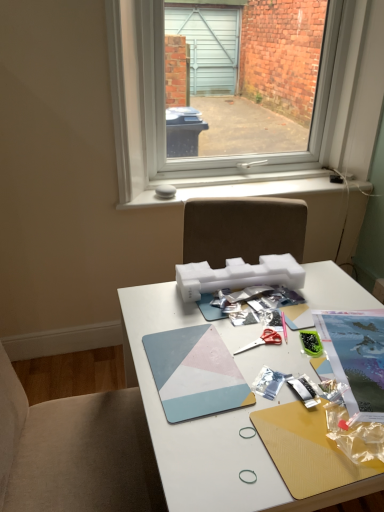
Question: From a real-world perspective, is red plastic scissors at center positioned over geometric matte mousepad at center, positioned as the first magazine in left-to-right order, based on gravity?

Choices:
 (A) no
 (B) yes

Answer: (A)

Question: Is red plastic scissors at center directly adjacent to geometric matte mousepad at center, positioned as the first magazine in left-to-right order?

Choices:
 (A) no
 (B) yes

Answer: (A)

Question: Is red plastic scissors at center looking in the opposite direction of geometric matte mousepad at center, positioned as the first magazine in left-to-right order?

Choices:
 (A) no
 (B) yes

Answer: (A)

Question: Is red plastic scissors at center not near geometric matte mousepad at center, acting as the 2th magazine starting from the right?

Choices:
 (A) no
 (B) yes

Answer: (A)

Question: Does red plastic scissors at center have a lesser width compared to geometric matte mousepad at center, acting as the 2th magazine starting from the right?

Choices:
 (A) no
 (B) yes

Answer: (B)

Question: Can you confirm if red plastic scissors at center is bigger than geometric matte mousepad at center, positioned as the first magazine in left-to-right order?

Choices:
 (A) no
 (B) yes

Answer: (A)

Question: Would you say white matte desk at center contains printed paper magazine at center right, the second magazine when ordered from left to right?

Choices:
 (A) no
 (B) yes

Answer: (B)

Question: Is white matte desk at center outside of printed paper magazine at center right, the first magazine positioned from the right?

Choices:
 (A) no
 (B) yes

Answer: (B)

Question: Is white matte desk at center positioned before printed paper magazine at center right, the second magazine when ordered from left to right?

Choices:
 (A) yes
 (B) no

Answer: (A)

Question: Can you confirm if white matte desk at center is thinner than printed paper magazine at center right, the second magazine when ordered from left to right?

Choices:
 (A) no
 (B) yes

Answer: (A)

Question: From the image's perspective, is white matte desk at center beneath printed paper magazine at center right, the first magazine positioned from the right?

Choices:
 (A) yes
 (B) no

Answer: (A)

Question: From a real-world perspective, is white matte desk at center positioned under printed paper magazine at center right, the second magazine when ordered from left to right, based on gravity?

Choices:
 (A) no
 (B) yes

Answer: (B)

Question: Are red plastic scissors at center and transparent glass window at upper center making contact?

Choices:
 (A) yes
 (B) no

Answer: (B)